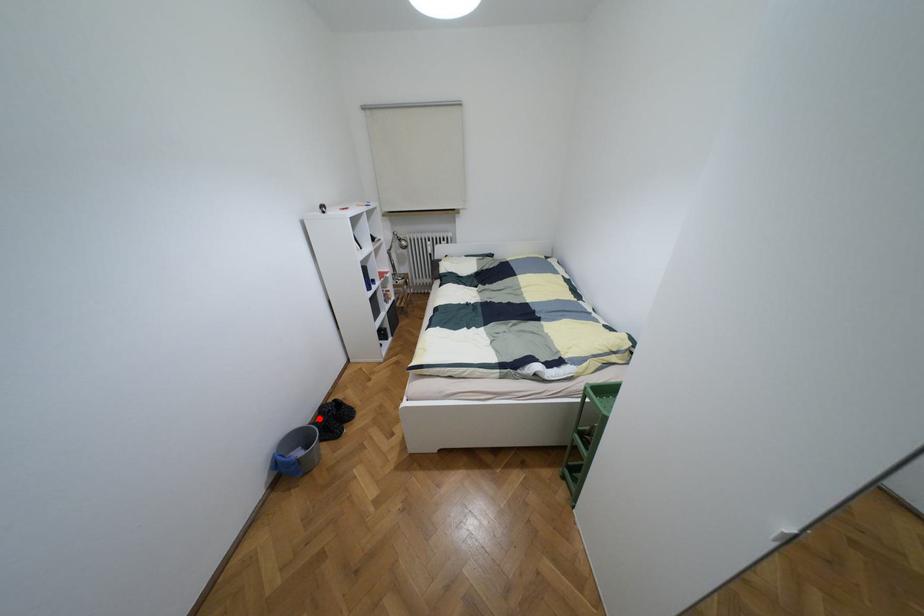
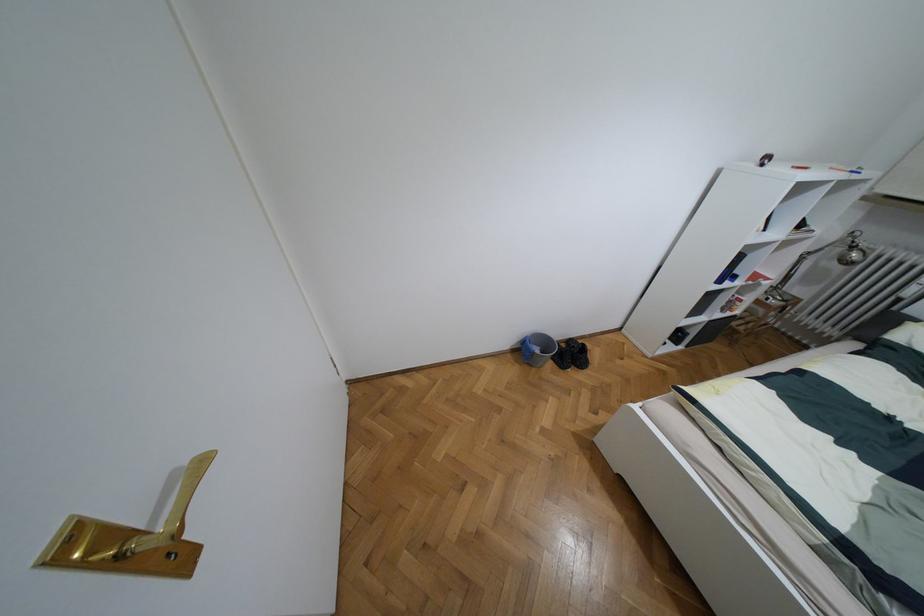
Locate, in the second image, the point that corresponds to the highlighted location in the first image.

(563, 345)